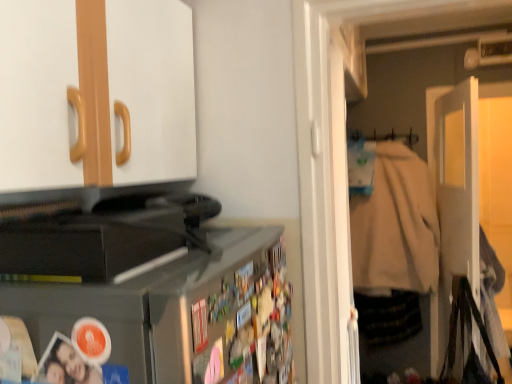
This screenshot has width=512, height=384. Identify the location of white fabric hanger at upper right. (385, 137).

The width and height of the screenshot is (512, 384). Describe the element at coordinates (385, 137) in the screenshot. I see `white fabric hanger at upper right` at that location.

In order to face beige cotton jacket at right, should I rotate leftwards or rightwards?

You should look right and rotate roughly 17.845 degrees.

In order to click on white fabric hanger at upper right in this screenshot , I will do `click(385, 137)`.

Can you tell me how much white matte door at right and black plastic toaster at lower left differ in facing direction?

There is a 5.94-degree angle between the facing directions of white matte door at right and black plastic toaster at lower left.

Between white matte door at right and black plastic toaster at lower left, which one has smaller size?

Smaller between the two is black plastic toaster at lower left.

How far apart are white matte door at right and black plastic toaster at lower left?

The distance of white matte door at right from black plastic toaster at lower left is 1.71 meters.

Is white matte door at right surrounding black plastic toaster at lower left?

Definitely not — black plastic toaster at lower left is not inside white matte door at right.

From the image's perspective, is black plastic toaster at lower left above or below white fabric hanger at upper right?

black plastic toaster at lower left is situated lower than white fabric hanger at upper right in the image.

Which is behind, point (125, 231) or point (405, 140)?

The point (405, 140) is farther.

Is black plastic toaster at lower left taller than white fabric hanger at upper right?

No, black plastic toaster at lower left is not taller than white fabric hanger at upper right.

Locate an element on the screen. The image size is (512, 384). appliance lying in front of the white fabric hanger at upper right is located at coordinates (96, 229).

Considering the sizes of objects white fabric hanger at upper right and beige cotton jacket at right in the image provided, who is smaller, white fabric hanger at upper right or beige cotton jacket at right?

With smaller size is white fabric hanger at upper right.

From a real-world perspective, between white fabric hanger at upper right and beige cotton jacket at right, who is vertically lower?

In real-world perspective, beige cotton jacket at right is lower.

From the picture: Who is shorter, white fabric hanger at upper right or beige cotton jacket at right?

white fabric hanger at upper right is shorter.

In the scene shown: In terms of width, does white matte door at right look wider or thinner when compared to beige cotton jacket at right?

Clearly, white matte door at right has less width compared to beige cotton jacket at right.

Which point is more distant from viewer, (449, 136) or (373, 276)?

The point (373, 276) is farther.

Is the depth of white matte door at right greater than that of beige cotton jacket at right?

No, the depth of white matte door at right is less than that of beige cotton jacket at right.

I want to click on appliance located above the white matte door at right (from a real-world perspective), so click(96, 229).

Measure the distance from black plastic toaster at lower left to white matte door at right.

1.71 meters.

Is black plastic toaster at lower left next to white matte door at right and touching it?

No, black plastic toaster at lower left is not making contact with white matte door at right.

Based on the photo, can you tell me how much black plastic toaster at lower left and white matte door at right differ in facing direction?

The angle between the facing direction of black plastic toaster at lower left and the facing direction of white matte door at right is 5.94 degrees.

This screenshot has width=512, height=384. Identify the location of appliance on the left of white fabric hanger at upper right. (96, 229).

From the image's perspective, between white fabric hanger at upper right and black plastic toaster at lower left, which one is located above?

From the image's view, white fabric hanger at upper right is above.

From a real-world perspective, between white fabric hanger at upper right and black plastic toaster at lower left, who is vertically higher?

white fabric hanger at upper right.

Can you confirm if white fabric hanger at upper right is taller than black plastic toaster at lower left?

Yes, white fabric hanger at upper right is taller than black plastic toaster at lower left.

Where is `door located in front of the beige cotton jacket at right`? The height and width of the screenshot is (384, 512). door located in front of the beige cotton jacket at right is located at coordinates (457, 195).

From a real-world perspective, which is physically above, beige cotton jacket at right or white matte door at right?

beige cotton jacket at right, from a real-world perspective.

Based on the photo, is beige cotton jacket at right not within white matte door at right?

Absolutely, beige cotton jacket at right is external to white matte door at right.

Based on the photo, is beige cotton jacket at right bigger or smaller than white matte door at right?

Considering their sizes, beige cotton jacket at right takes up more space than white matte door at right.

The image size is (512, 384). Find the location of `door below the black plastic toaster at lower left (from the image's perspective)`. door below the black plastic toaster at lower left (from the image's perspective) is located at coordinates (457, 195).

Find the location of a particular element. appliance below the white fabric hanger at upper right (from a real-world perspective) is located at coordinates (96, 229).

Estimate the real-world distances between objects in this image. Which object is further from black plastic toaster at lower left, beige cotton jacket at right or white fabric hanger at upper right?

Among the two, white fabric hanger at upper right is located further to black plastic toaster at lower left.

From the picture: When comparing their distances from white matte door at right, does black plastic toaster at lower left or beige cotton jacket at right seem further?

Based on the image, black plastic toaster at lower left appears to be further to white matte door at right.

When comparing their distances from beige cotton jacket at right, does black plastic toaster at lower left or white fabric hanger at upper right seem further?

black plastic toaster at lower left lies further to beige cotton jacket at right than the other object.

Which object lies further to the anchor point black plastic toaster at lower left, white matte door at right or beige cotton jacket at right?

beige cotton jacket at right is positioned further to the anchor black plastic toaster at lower left.

Estimate the real-world distances between objects in this image. Which object is closer to white matte door at right, beige cotton jacket at right or black plastic toaster at lower left?

Among the two, beige cotton jacket at right is located nearer to white matte door at right.

Estimate the real-world distances between objects in this image. Which object is closer to white fabric hanger at upper right, black plastic toaster at lower left or white matte door at right?

white matte door at right is closer to white fabric hanger at upper right.

Considering their positions, is beige cotton jacket at right positioned further to black plastic toaster at lower left than white matte door at right?

The object further to black plastic toaster at lower left is beige cotton jacket at right.

From the picture: When comparing their distances from black plastic toaster at lower left, does white fabric hanger at upper right or beige cotton jacket at right seem closer?

beige cotton jacket at right.

Identify the location of door located between black plastic toaster at lower left and white fabric hanger at upper right in the depth direction. (457, 195).

The height and width of the screenshot is (384, 512). Find the location of `door positioned between black plastic toaster at lower left and beige cotton jacket at right from near to far`. door positioned between black plastic toaster at lower left and beige cotton jacket at right from near to far is located at coordinates tap(457, 195).

Image resolution: width=512 pixels, height=384 pixels. I want to click on jacket between white fabric hanger at upper right and white matte door at right vertically, so click(x=395, y=225).

You are a GUI agent. You are given a task and a screenshot of the screen. Output one action in this format:
    pyautogui.click(x=<x>, y=<y>)
    Task: Click on the jacket between black plastic toaster at lower left and white fabric hanger at upper right in the front-back direction
    This screenshot has height=384, width=512.
    Given the screenshot: What is the action you would take?
    pyautogui.click(x=395, y=225)